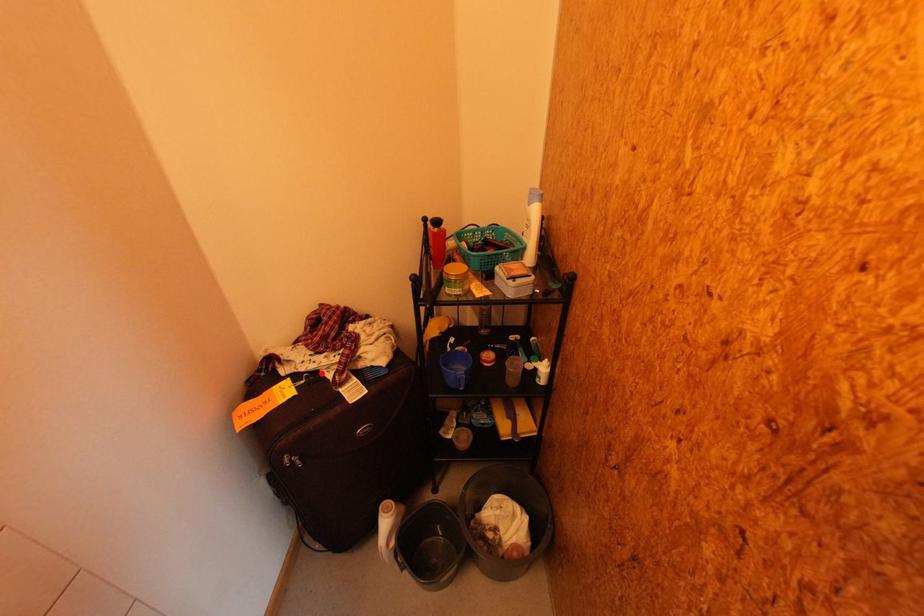
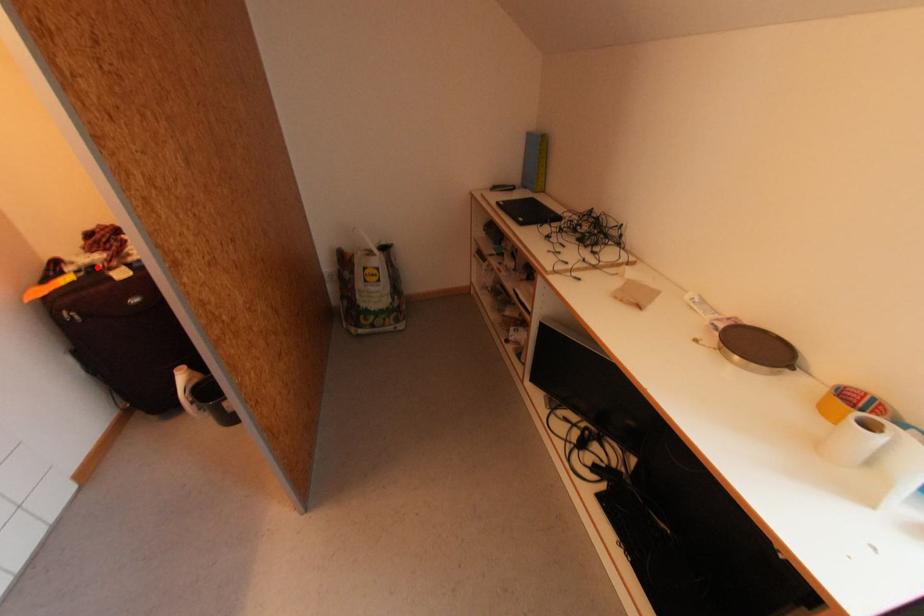
I am providing you with two images of the same scene from different viewpoints. A red point is marked on the first image and another point is marked on the second image. Do the highlighted points in image1 and image2 indicate the same real-world spot?

Yes